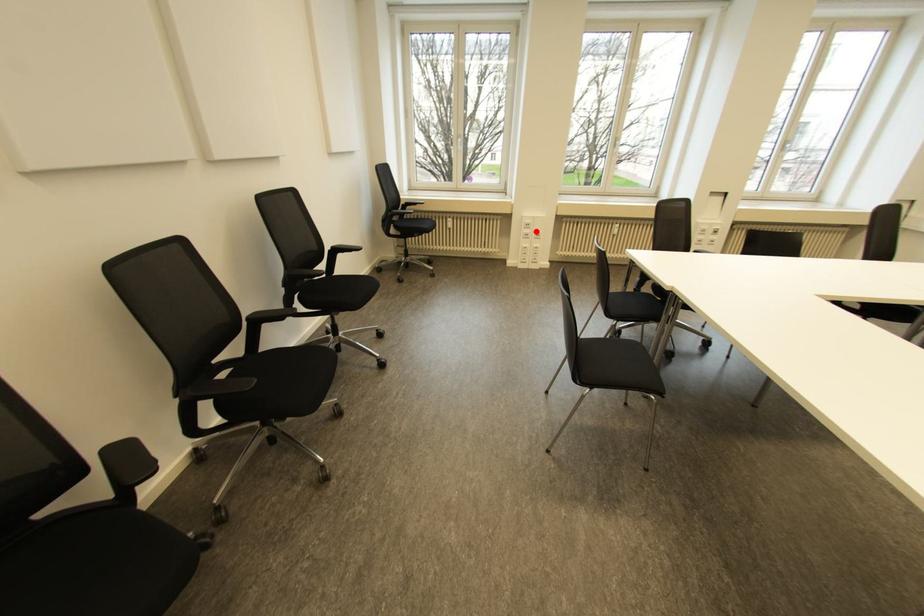
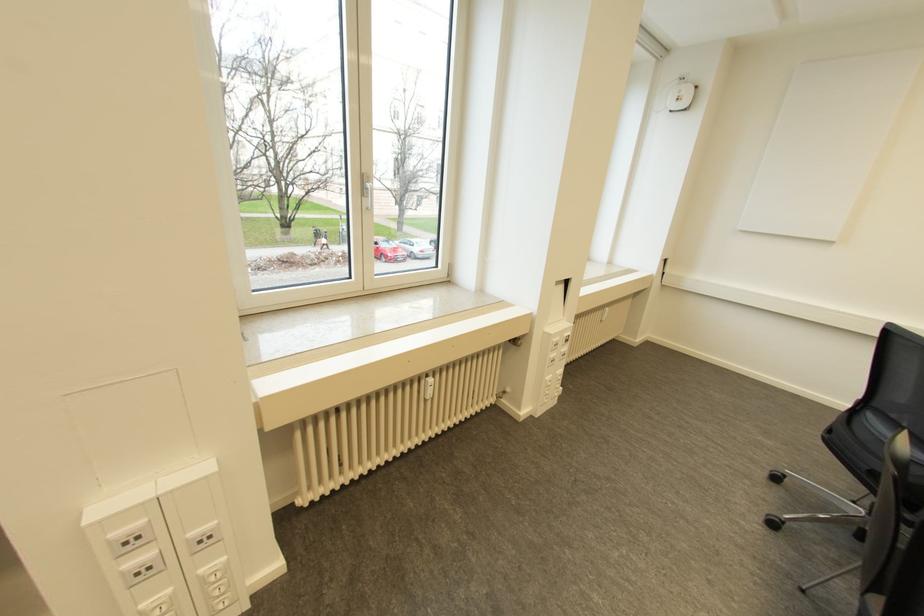
Question: I am providing you with two images of the same scene from different viewpoints. A red point is shown in image1. For the corresponding object point in image2, is it positioned nearer or farther from the camera?

Choices:
 (A) Nearer
 (B) Farther

Answer: (B)